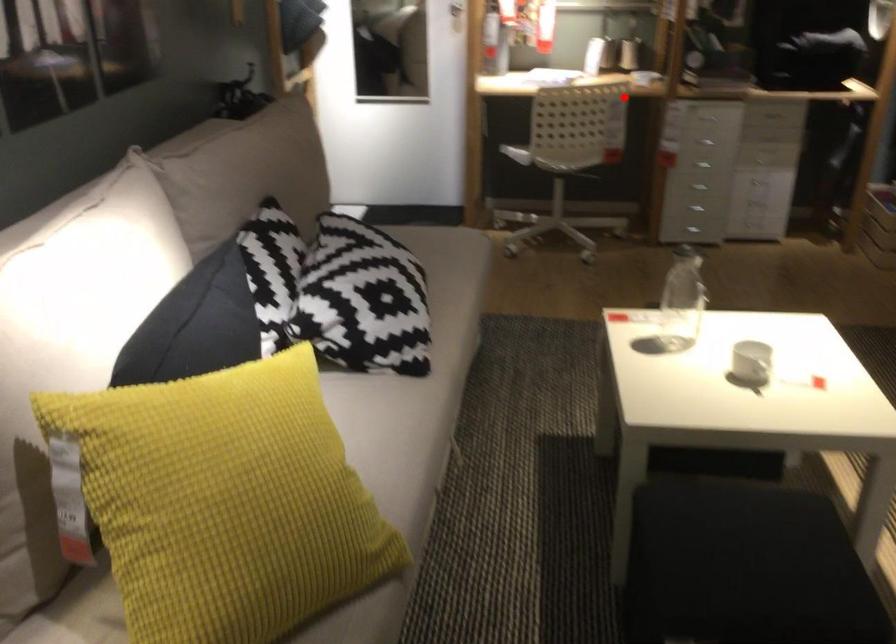
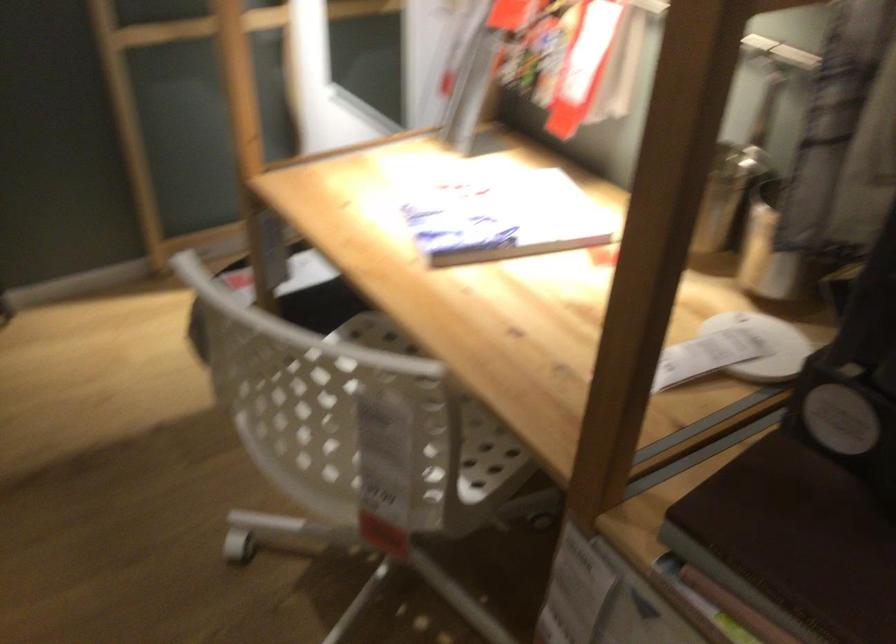
The point at the highlighted location is marked in the first image. Where is the corresponding point in the second image?

(371, 418)